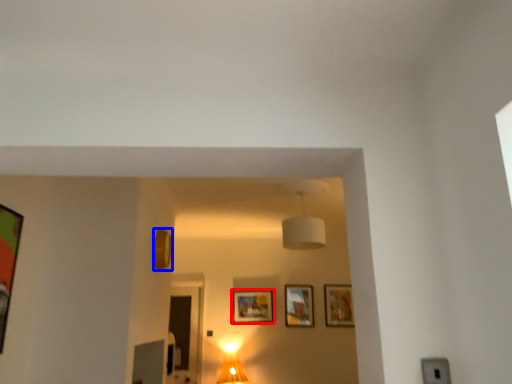
Question: Which point is further to the camera, picture frame (highlighted by a red box) or picture frame (highlighted by a blue box)?

Choices:
 (A) picture frame
 (B) picture frame

Answer: (A)